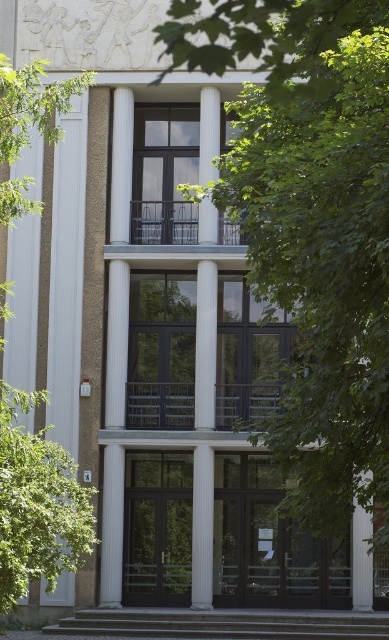
You are standing in front of the modern building and notice a point marked at coordinates (310,227). Based on the scene description, can you identify what object this point is located on?

The point at coordinates (310,227) is located on the green leafy tree at center.

You are an architect designing a new building and want to ensure there is enough space between the white glossy column at center and the white smooth column at center for a 10 feet wide sculpture. Can the sculpture fit between them?

The white glossy column at center and the white smooth column at center are 15.28 feet apart, so the 10 feet wide sculpture can fit between them since the distance is greater than the sculpture width.

You are a delivery person trying to deliver a package to the building. You need to know which object is bigger between the white glossy column at center and the concrete stairs at lower center to decide if you can pass through. Can you tell me which one is bigger?

The white glossy column at center has a larger size compared to the concrete stairs at lower center, so the white glossy column at center is bigger.